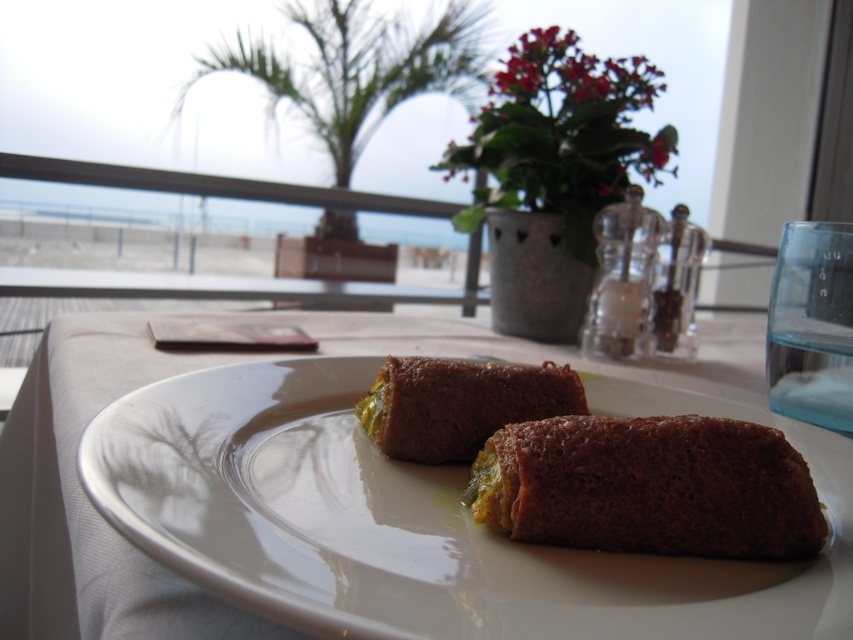
You are a food critic who wants to taste the brown crispy pastry at center and the brown crumbly cake at center. Which one is closer to you?

The brown crispy pastry at center is closer to you because it is positioned under the brown crumbly cake at center, indicating it is in front.

You are a waiter placing a dessert menu on the table. The menu needs to be placed such that it doesn not cover the brown crispy pastry at center. Where should you place the dessert menu?

The brown crispy pastry at center is located at point (421,520). To avoid covering it, place the dessert menu in an area not overlapping with these coordinates, such as the lower left corner of the table.

You are a food critic sitting at the table and want to take a bite of the brown crispy pastry at center and the brown crumbly cake at center. Which one is closer to you?

The brown crispy pastry at center is closer to you because it is in front of the brown crumbly cake at center.